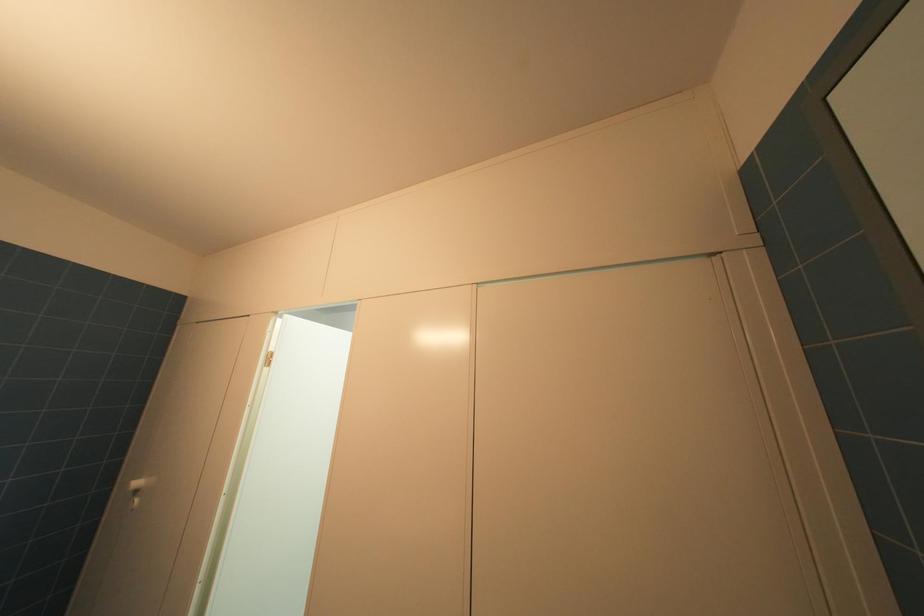
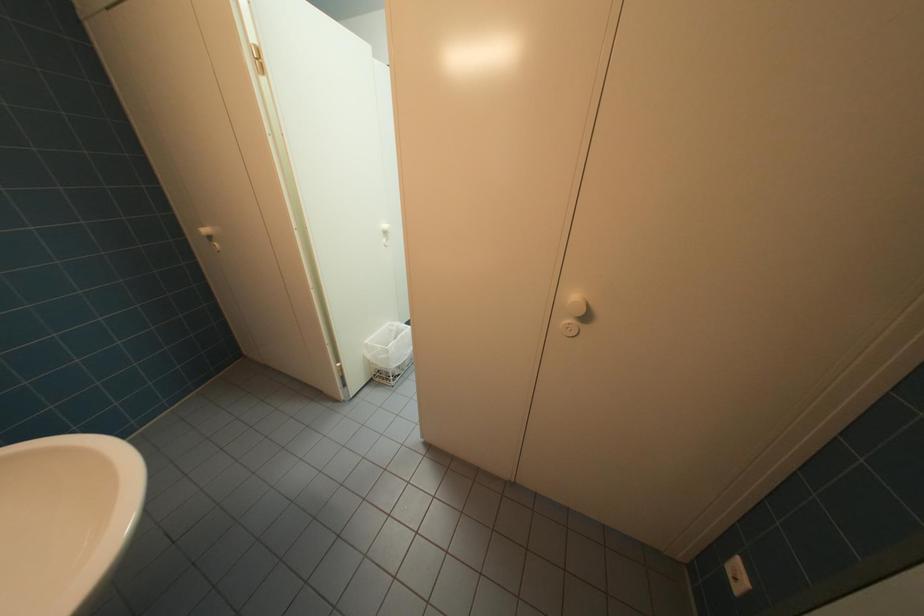
Question: How did the camera likely rotate?

Choices:
 (A) Left
 (B) Right
 (C) Up
 (D) Down

Answer: (D)